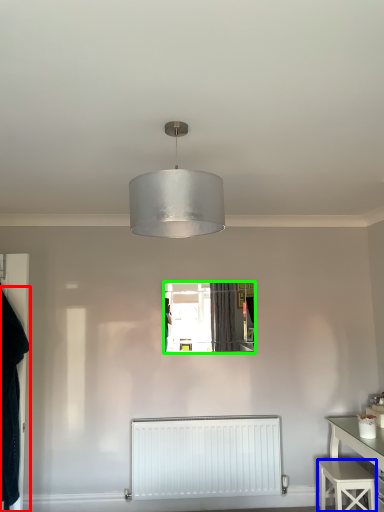
Question: Which is nearer to the clothing (highlighted by a red box)? stool (highlighted by a blue box) or mirror (highlighted by a green box).

Choices:
 (A) stool
 (B) mirror

Answer: (B)